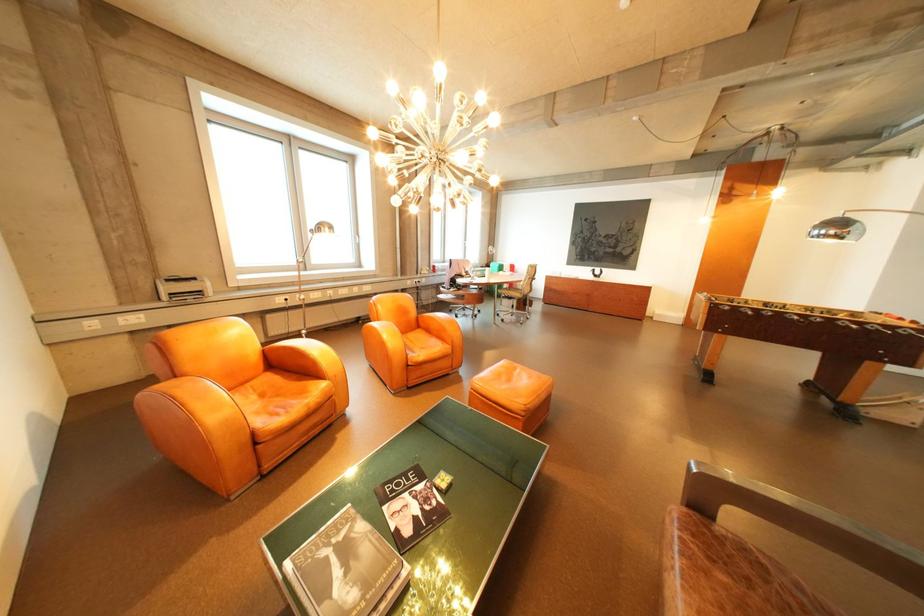
Where is `black cover book`? The image size is (924, 616). black cover book is located at coordinates (410, 506).